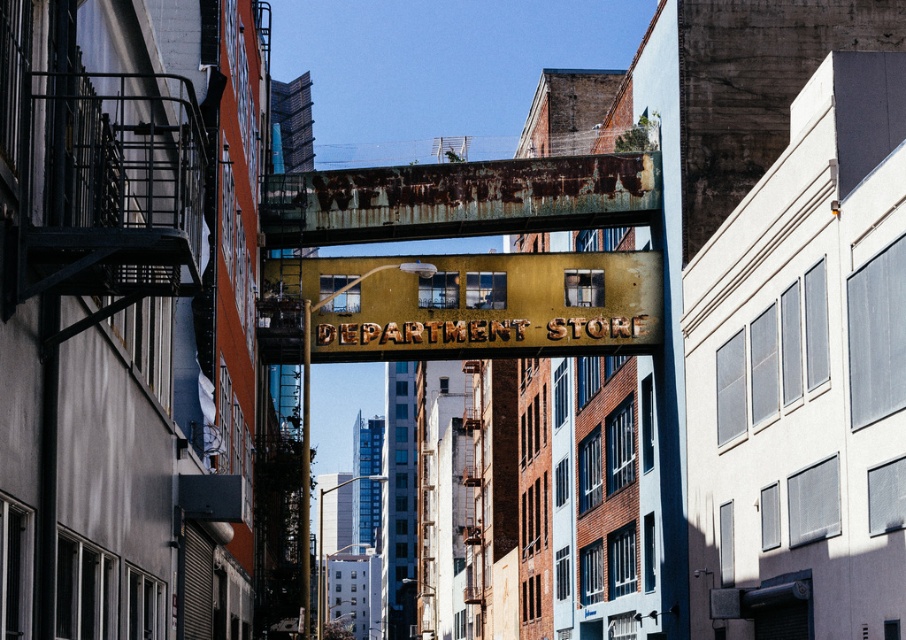
Question: Does rusty gold sign at center come behind rusty metal sign at center?

Choices:
 (A) no
 (B) yes

Answer: (A)

Question: Which point is farther to the camera?

Choices:
 (A) pos(535,173)
 (B) pos(394,260)

Answer: (A)

Question: Is rusty gold sign at center smaller than rusty metal sign at center?

Choices:
 (A) no
 (B) yes

Answer: (A)

Question: Which point is farther to the camera?

Choices:
 (A) (567, 209)
 (B) (584, 291)

Answer: (B)

Question: Which point is closer to the camera?

Choices:
 (A) rusty gold sign at center
 (B) rusty metal sign at center

Answer: (A)

Question: Does rusty gold sign at center have a smaller size compared to rusty metal sign at center?

Choices:
 (A) no
 (B) yes

Answer: (A)